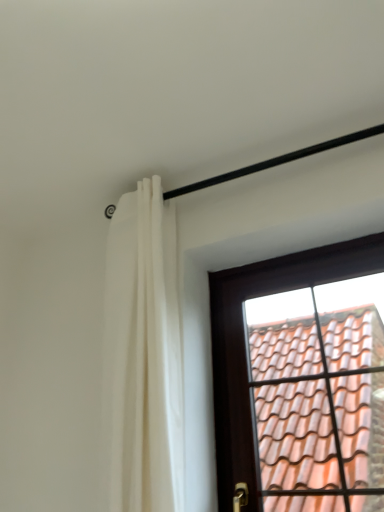
Question: Looking at the image, does white fabric curtain at upper left seem bigger or smaller compared to brown wooden window at upper right?

Choices:
 (A) big
 (B) small

Answer: (A)

Question: From a real-world perspective, is white fabric curtain at upper left positioned above or below brown wooden window at upper right?

Choices:
 (A) below
 (B) above

Answer: (B)

Question: Considering the positions of white fabric curtain at upper left and brown wooden window at upper right in the image, is white fabric curtain at upper left wider or thinner than brown wooden window at upper right?

Choices:
 (A) thin
 (B) wide

Answer: (B)

Question: Is point (223, 489) closer or farther from the camera than point (109, 240)?

Choices:
 (A) farther
 (B) closer

Answer: (B)

Question: In terms of width, does brown wooden window at upper right look wider or thinner when compared to white fabric curtain at upper left?

Choices:
 (A) thin
 (B) wide

Answer: (A)

Question: From a real-world perspective, is brown wooden window at upper right above or below white fabric curtain at upper left?

Choices:
 (A) below
 (B) above

Answer: (A)

Question: Relative to white fabric curtain at upper left, is brown wooden window at upper right in front or behind?

Choices:
 (A) behind
 (B) front

Answer: (A)